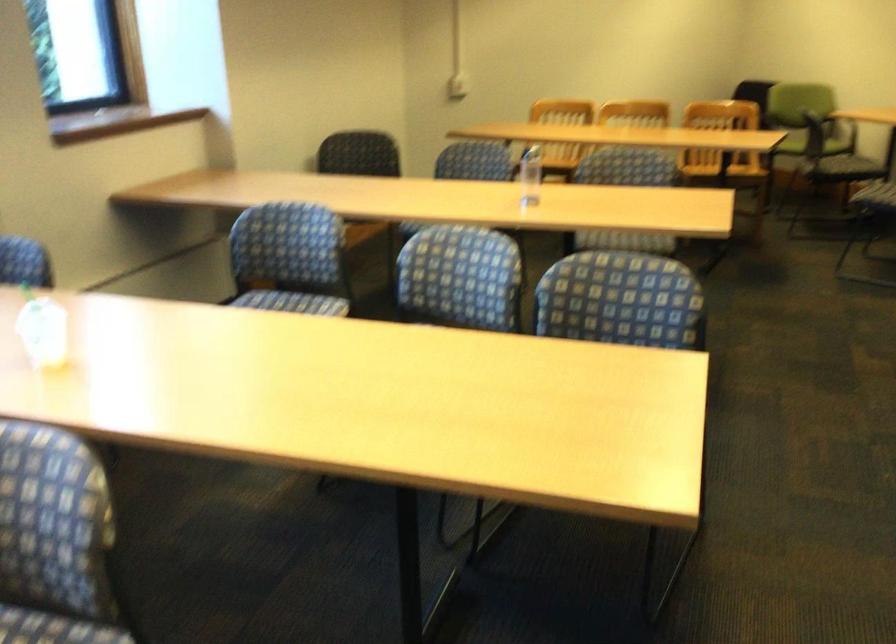
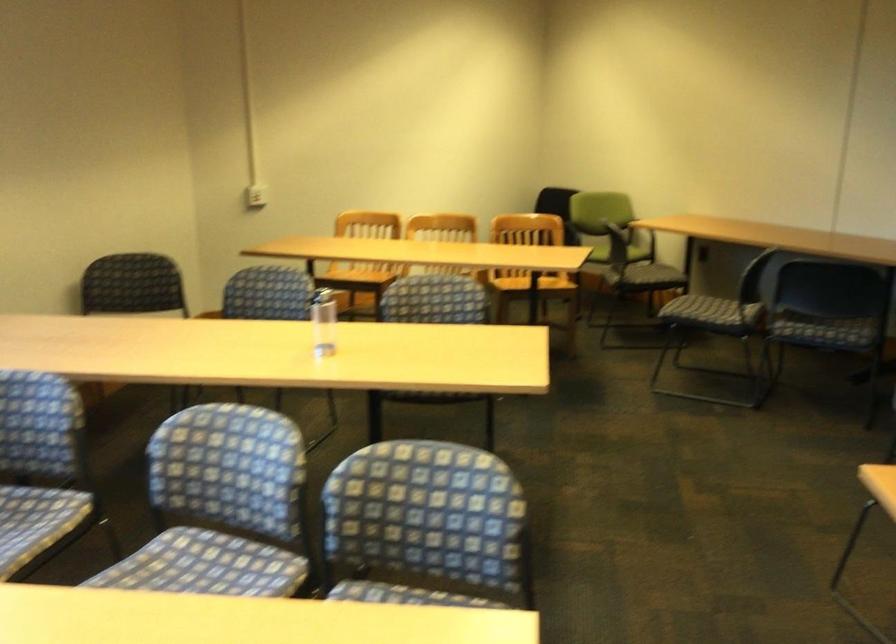
The point at [452,304] is marked in the first image. Where is the corresponding point in the second image?

(221, 506)